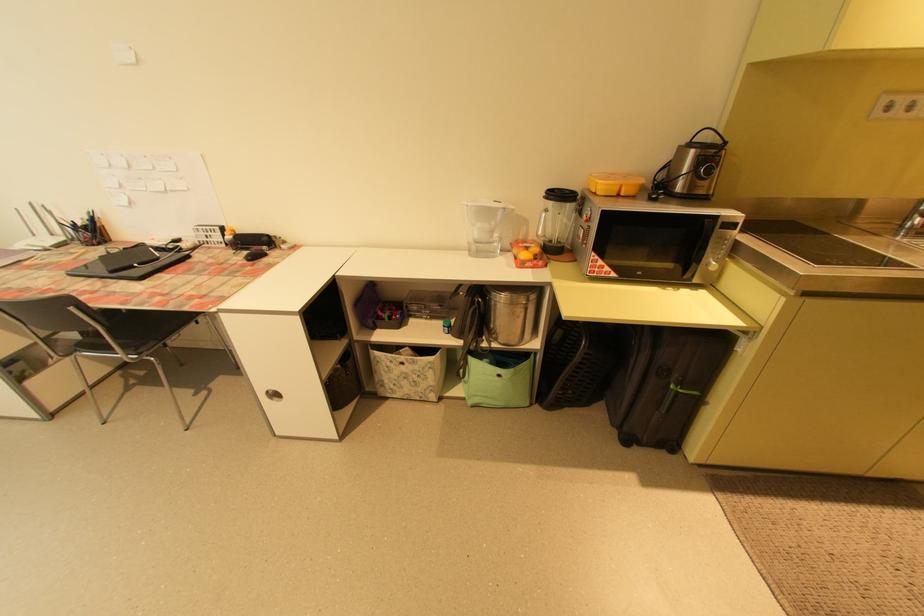
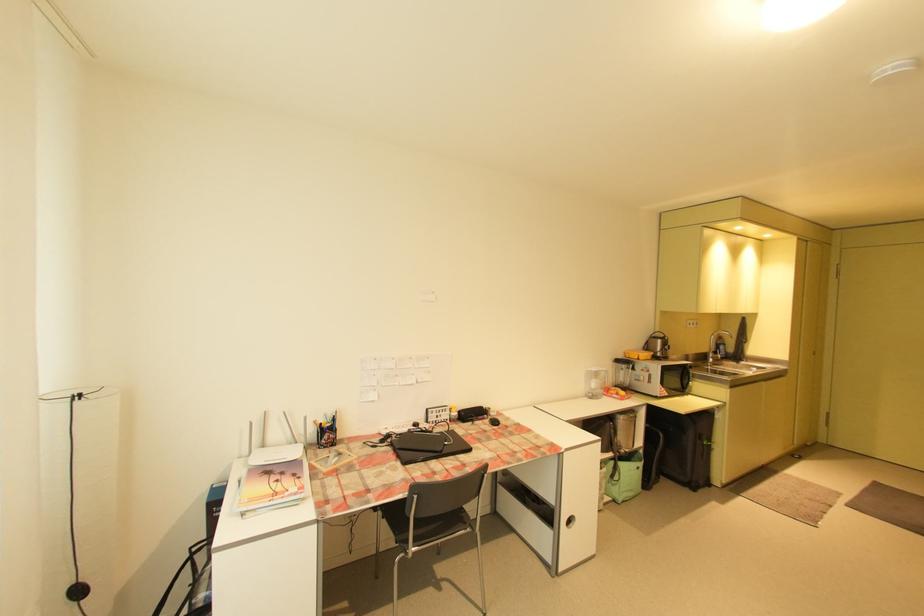
Where in the second image is the point corresponding to pixel 511 209 from the first image?

(613, 371)